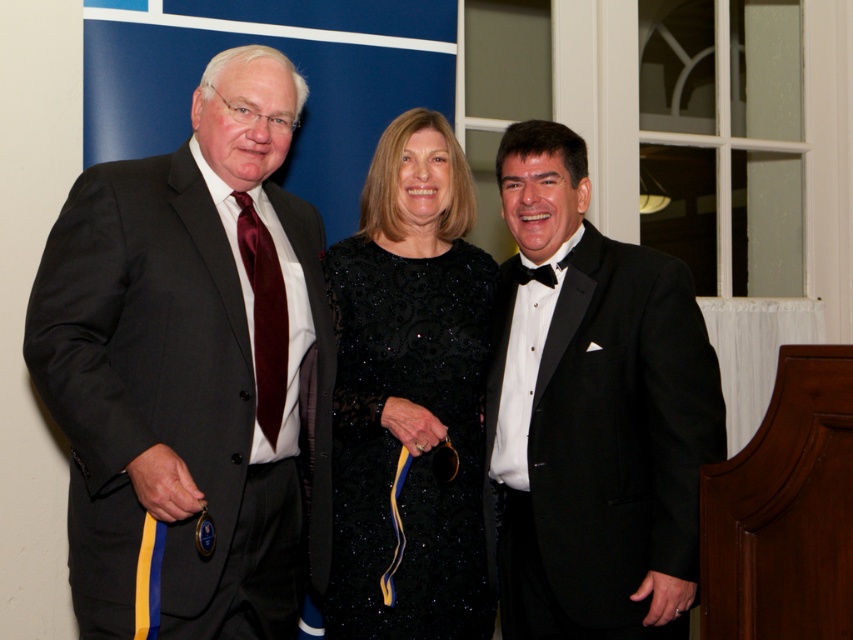
Question: Is black satin tuxedo at right smaller than black sequined dress at center?

Choices:
 (A) yes
 (B) no

Answer: (B)

Question: Which object is farther from the camera taking this photo?

Choices:
 (A) black sequined dress at center
 (B) black satin tuxedo at right
 (C) matte black suit at left

Answer: (A)

Question: From the image, what is the correct spatial relationship of black satin tuxedo at right in relation to black sequined dress at center?

Choices:
 (A) right
 (B) left

Answer: (A)

Question: Which point appears farthest from the camera in this image?

Choices:
 (A) (444, 500)
 (B) (305, 305)
 (C) (532, 499)

Answer: (B)

Question: Which point appears farthest from the camera in this image?

Choices:
 (A) (262, 349)
 (B) (532, 204)

Answer: (B)

Question: Does matte black suit at left have a larger size compared to black satin tuxedo at right?

Choices:
 (A) yes
 (B) no

Answer: (A)